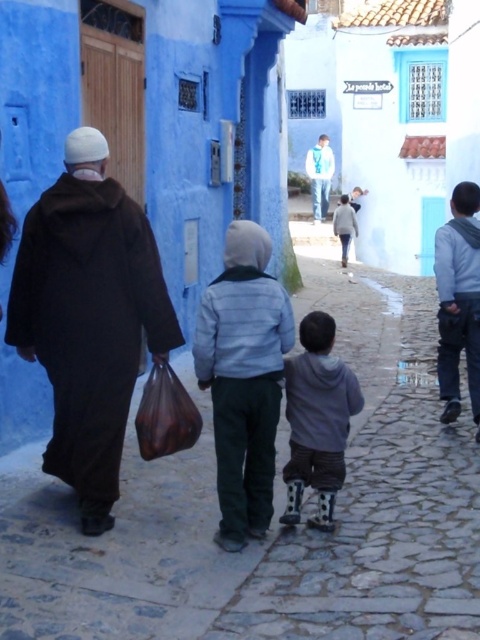
You are standing on the cobblestone street and want to hand a leaflet to both the dark brown woolen robe at left and the white matte jacket at center. Which person should you approach first based on their positions?

You should approach the dark brown woolen robe at left first because it is positioned under the white matte jacket at center, indicating it is closer to you.

You are a photographer standing on the cobblestone street and want to take a picture of the two people in the foreground. The dark brown woolen robe at left and the white matte jacket at center. Which person should you focus on first if you want to capture both in the frame without moving the camera?

You should focus on the white matte jacket at center first because the dark brown woolen robe at left is not as tall as the white matte jacket at center, so the taller person will be easier to frame properly.